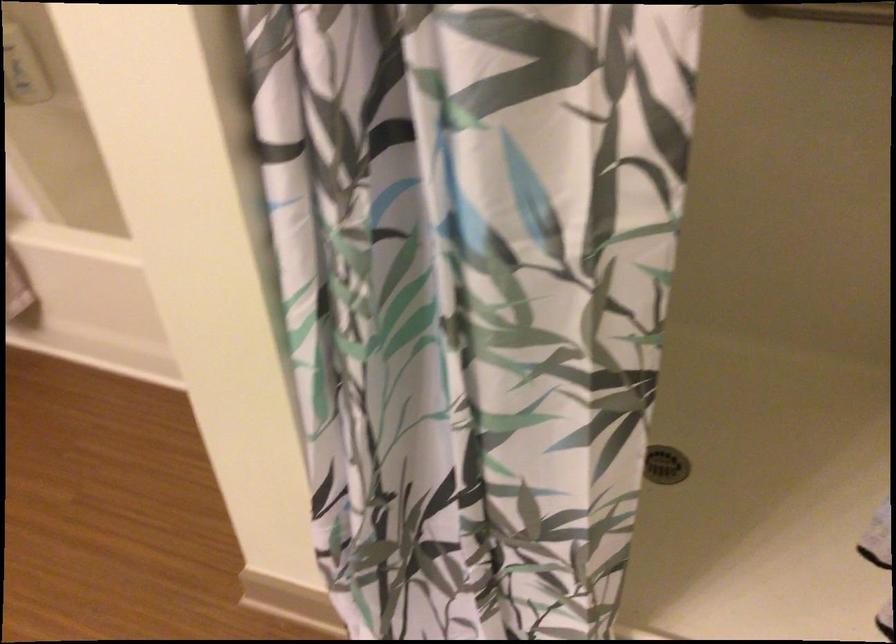
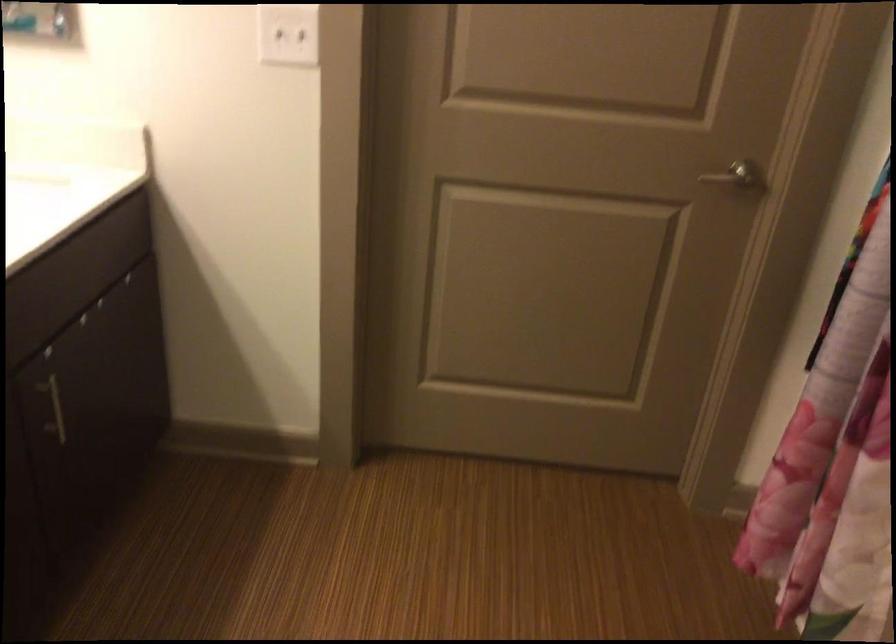
Question: The first image is from the beginning of the video and the second image is from the end. How did the camera likely rotate when shooting the video?

Choices:
 (A) Left
 (B) Right
 (C) Up
 (D) Down

Answer: (A)